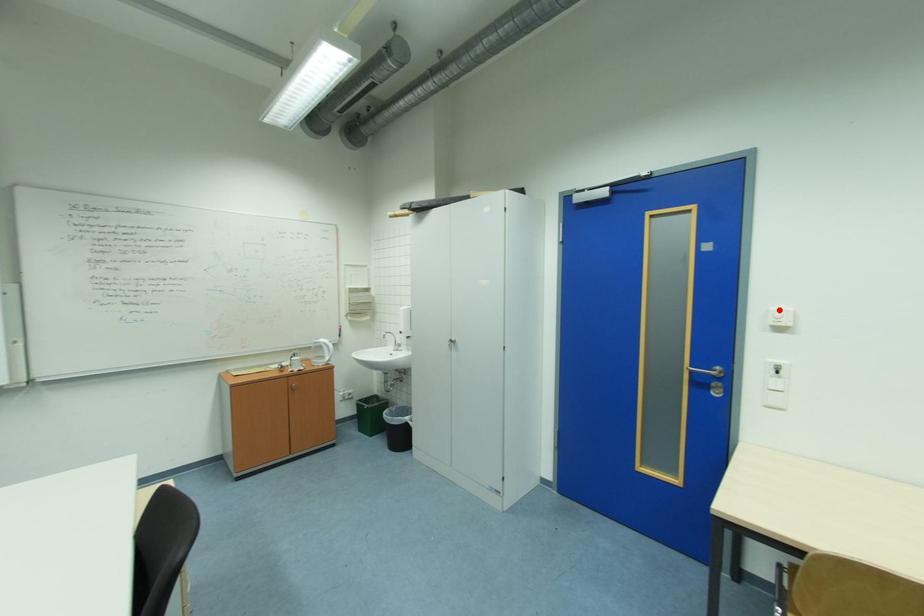
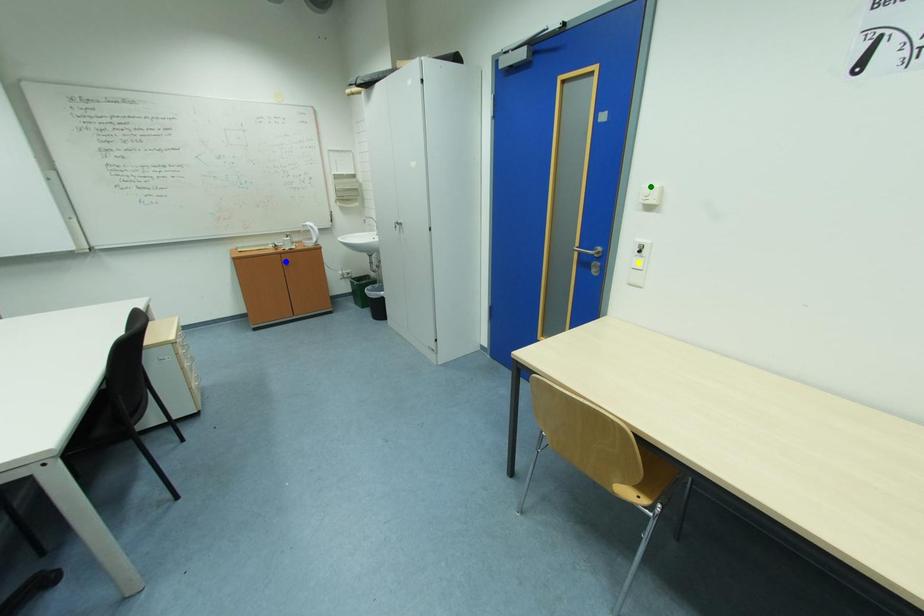
Question: I am providing you with two images of the same scene from different viewpoints. A red point is marked on the first image. You are given multiple points on the second image. Which spot in image 2 lines up with the point in image 1?

Choices:
 (A) green point
 (B) blue point
 (C) yellow point

Answer: (A)